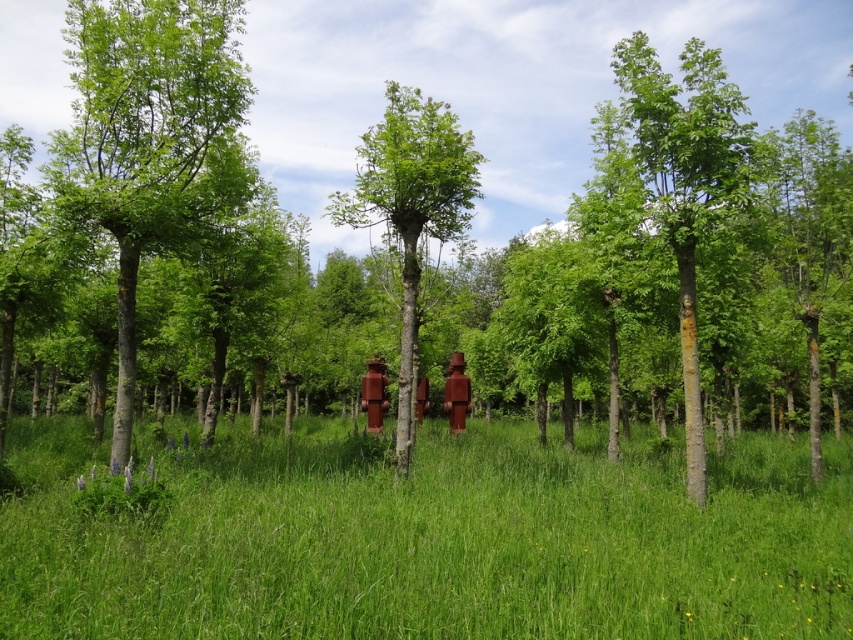
Between green grassy at center and green smooth tree at left, which one is positioned lower?

green grassy at center

Does green grassy at center have a greater width compared to green smooth tree at left?

Yes, green grassy at center is wider than green smooth tree at left.

Measure the distance between point [698,531] and camera.

Point [698,531] is 6.35 meters away from camera.

Identify the location of green grassy at center. The height and width of the screenshot is (640, 853). (430, 538).

Which is behind, point (460, 596) or point (680, 67)?

Point (680, 67)

Who is shorter, green grassy at center or green smooth bark tree at center?

green grassy at center

Is point (782, 604) positioned before point (682, 275)?

Yes, it is in front of point (682, 275).

Where is `green grassy at center`? Image resolution: width=853 pixels, height=640 pixels. green grassy at center is located at coordinates (430, 538).

Who is more forward, (x=154, y=625) or (x=399, y=186)?

Point (x=154, y=625) is in front.

Does point (323, 477) lie behind point (376, 132)?

That is False.

What are the coordinates of `green grassy at center` in the screenshot? It's located at pyautogui.click(x=430, y=538).